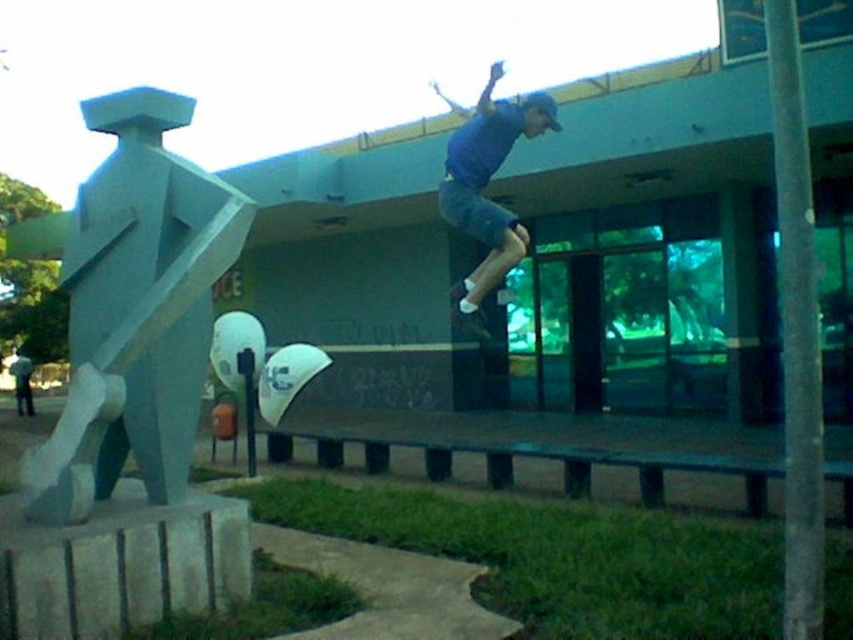
Question: Which point is farther from the camera taking this photo?

Choices:
 (A) (479, 186)
 (B) (474, 330)

Answer: (B)

Question: Is light blue stone statue at left bigger than blue matte skateboard at upper center?

Choices:
 (A) yes
 (B) no

Answer: (B)

Question: Which object is the closest to the blue matte skateboard at upper center?

Choices:
 (A) white rubber skateboard at center
 (B) light blue stone statue at left

Answer: (A)

Question: Among these objects, which one is nearest to the camera?

Choices:
 (A) blue matte skateboard at upper center
 (B) white rubber skateboard at center

Answer: (A)

Question: Is light blue stone statue at left behind blue matte skateboard at upper center?

Choices:
 (A) no
 (B) yes

Answer: (A)

Question: Can you confirm if blue matte skateboard at upper center is positioned below white rubber skateboard at center?

Choices:
 (A) yes
 (B) no

Answer: (B)